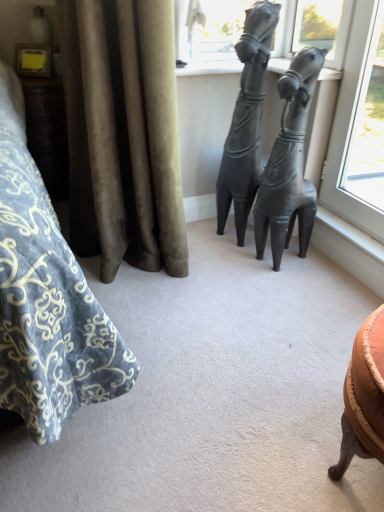
This screenshot has width=384, height=512. What do you see at coordinates (246, 121) in the screenshot?
I see `matte black statue at center, acting as the second statue (sculpture) starting from the right` at bounding box center [246, 121].

Find the location of a particular element. The width and height of the screenshot is (384, 512). velvet curtain at left is located at coordinates (123, 134).

Between matte black statue at center, positioned as the 2th statue (sculpture) in left-to-right order, and matte black statue at center, the first statue (sculpture) in the left-to-right sequence, which one is positioned behind?

matte black statue at center, the first statue (sculpture) in the left-to-right sequence, is further from the camera.

Who is smaller, matte black statue at center, positioned as the 2th statue (sculpture) in left-to-right order, or matte black statue at center, the first statue (sculpture) in the left-to-right sequence?

matte black statue at center, positioned as the 2th statue (sculpture) in left-to-right order, is smaller.

Is matte black statue at center, the first statue (sculpture) in the left-to-right sequence, at the back of matte black statue at center, positioned as the 2th statue (sculpture) in left-to-right order?

That's not correct — matte black statue at center, positioned as the 2th statue (sculpture) in left-to-right order, is not looking away from matte black statue at center, the first statue (sculpture) in the left-to-right sequence.

From the image's perspective, is matte black statue at center, positioned as the 2th statue (sculpture) in left-to-right order, located above matte black statue at center, the first statue (sculpture) in the left-to-right sequence?

Actually, matte black statue at center, positioned as the 2th statue (sculpture) in left-to-right order, appears below matte black statue at center, the first statue (sculpture) in the left-to-right sequence, in the image.

I want to click on curtain lying above the matte black statue at center, the first statue (sculpture) in the left-to-right sequence (from the image's perspective), so click(x=123, y=134).

Who is taller, matte black statue at center, the first statue (sculpture) in the left-to-right sequence, or velvet curtain at left?

matte black statue at center, the first statue (sculpture) in the left-to-right sequence.

Is matte black statue at center, the first statue (sculpture) in the left-to-right sequence, facing away from velvet curtain at left?

No, velvet curtain at left is not at the back of matte black statue at center, the first statue (sculpture) in the left-to-right sequence.

From the picture: Does matte black statue at center, acting as the second statue (sculpture) starting from the right, contain velvet curtain at left?

No, velvet curtain at left is not inside matte black statue at center, acting as the second statue (sculpture) starting from the right.

Visually, is velvet curtain at left positioned to the left or to the right of matte black statue at center, which appears as the first statue (sculpture) when viewed from the right?

Clearly, velvet curtain at left is on the left of matte black statue at center, which appears as the first statue (sculpture) when viewed from the right, in the image.

Does velvet curtain at left have a lesser height compared to matte black statue at center, positioned as the 2th statue (sculpture) in left-to-right order?

Correct, velvet curtain at left is not as tall as matte black statue at center, positioned as the 2th statue (sculpture) in left-to-right order.

Measure the distance from velvet curtain at left to matte black statue at center, positioned as the 2th statue (sculpture) in left-to-right order.

velvet curtain at left is 24.75 inches from matte black statue at center, positioned as the 2th statue (sculpture) in left-to-right order.

Which point is more forward, (110, 136) or (277, 150)?

The point (110, 136) is closer to the camera.

Can you confirm if matte black statue at center, acting as the second statue (sculpture) starting from the right, is shorter than matte black statue at center, positioned as the 2th statue (sculpture) in left-to-right order?

No, matte black statue at center, acting as the second statue (sculpture) starting from the right, is not shorter than matte black statue at center, positioned as the 2th statue (sculpture) in left-to-right order.

Is matte black statue at center, the first statue (sculpture) in the left-to-right sequence, to the left or to the right of matte black statue at center, positioned as the 2th statue (sculpture) in left-to-right order, in the image?

matte black statue at center, the first statue (sculpture) in the left-to-right sequence, is positioned on matte black statue at center, positioned as the 2th statue (sculpture) in left-to-right order,'s left side.

From a real-world perspective, which is physically above, matte black statue at center, acting as the second statue (sculpture) starting from the right, or matte black statue at center, positioned as the 2th statue (sculpture) in left-to-right order?

matte black statue at center, acting as the second statue (sculpture) starting from the right, from a real-world perspective.

Considering the sizes of objects velvet curtain at left and matte black statue at center, the first statue (sculpture) in the left-to-right sequence, in the image provided, who is shorter, velvet curtain at left or matte black statue at center, the first statue (sculpture) in the left-to-right sequence,?

velvet curtain at left is shorter.

Is point (155, 208) farther from viewer compared to point (256, 94)?

No, it is not.

Does velvet curtain at left lie behind matte black statue at center, the first statue (sculpture) in the left-to-right sequence?

No, the depth of velvet curtain at left is less than that of matte black statue at center, the first statue (sculpture) in the left-to-right sequence.

Can you confirm if velvet curtain at left is smaller than matte black statue at center, the first statue (sculpture) in the left-to-right sequence?

Incorrect, velvet curtain at left is not smaller in size than matte black statue at center, the first statue (sculpture) in the left-to-right sequence.

Can you tell me how much matte black statue at center, positioned as the 2th statue (sculpture) in left-to-right order, and velvet curtain at left differ in facing direction?

matte black statue at center, positioned as the 2th statue (sculpture) in left-to-right order, and velvet curtain at left are facing 19.9 degrees away from each other.

Is velvet curtain at left located within matte black statue at center, which appears as the first statue (sculpture) when viewed from the right?

No, velvet curtain at left is not surrounded by matte black statue at center, which appears as the first statue (sculpture) when viewed from the right.

Considering the sizes of objects matte black statue at center, which appears as the first statue (sculpture) when viewed from the right, and velvet curtain at left in the image provided, who is wider, matte black statue at center, which appears as the first statue (sculpture) when viewed from the right, or velvet curtain at left?

With larger width is velvet curtain at left.

Considering the sizes of objects matte black statue at center, which appears as the first statue (sculpture) when viewed from the right, and velvet curtain at left in the image provided, who is taller, matte black statue at center, which appears as the first statue (sculpture) when viewed from the right, or velvet curtain at left?

With more height is matte black statue at center, which appears as the first statue (sculpture) when viewed from the right.

The width and height of the screenshot is (384, 512). Identify the location of statue (sculpture) that is behind the matte black statue at center, positioned as the 2th statue (sculpture) in left-to-right order. (246, 121).

The height and width of the screenshot is (512, 384). In order to click on the 1st statue (sculpture) positioned below the velvet curtain at left (from the image's perspective) in this screenshot , I will do point(246,121).

Based on their spatial positions, is velvet curtain at left or matte black statue at center, positioned as the 2th statue (sculpture) in left-to-right order, further from matte black statue at center, the first statue (sculpture) in the left-to-right sequence?

velvet curtain at left is positioned further to the anchor matte black statue at center, the first statue (sculpture) in the left-to-right sequence.

Looking at the image, which one is located further to matte black statue at center, the first statue (sculpture) in the left-to-right sequence, matte black statue at center, which appears as the first statue (sculpture) when viewed from the right, or velvet curtain at left?

Based on the image, velvet curtain at left appears to be further to matte black statue at center, the first statue (sculpture) in the left-to-right sequence.

Considering their positions, is velvet curtain at left positioned further to matte black statue at center, positioned as the 2th statue (sculpture) in left-to-right order, than matte black statue at center, acting as the second statue (sculpture) starting from the right?

Based on the image, velvet curtain at left appears to be further to matte black statue at center, positioned as the 2th statue (sculpture) in left-to-right order.

Estimate the real-world distances between objects in this image. Which object is further from velvet curtain at left, matte black statue at center, positioned as the 2th statue (sculpture) in left-to-right order, or matte black statue at center, the first statue (sculpture) in the left-to-right sequence?

Answer: Among the two, matte black statue at center, positioned as the 2th statue (sculpture) in left-to-right order, is located further to velvet curtain at left.

Which object lies nearer to the anchor point matte black statue at center, positioned as the 2th statue (sculpture) in left-to-right order, matte black statue at center, acting as the second statue (sculpture) starting from the right, or velvet curtain at left?

matte black statue at center, acting as the second statue (sculpture) starting from the right, is closer to matte black statue at center, positioned as the 2th statue (sculpture) in left-to-right order.

Which object lies further to the anchor point velvet curtain at left, matte black statue at center, the first statue (sculpture) in the left-to-right sequence, or matte black statue at center, positioned as the 2th statue (sculpture) in left-to-right order?

The object further to velvet curtain at left is matte black statue at center, positioned as the 2th statue (sculpture) in left-to-right order.

Where is `statue (sculpture) between velvet curtain at left and matte black statue at center, which appears as the first statue (sculpture) when viewed from the right, in the horizontal direction`? statue (sculpture) between velvet curtain at left and matte black statue at center, which appears as the first statue (sculpture) when viewed from the right, in the horizontal direction is located at coordinates (246, 121).